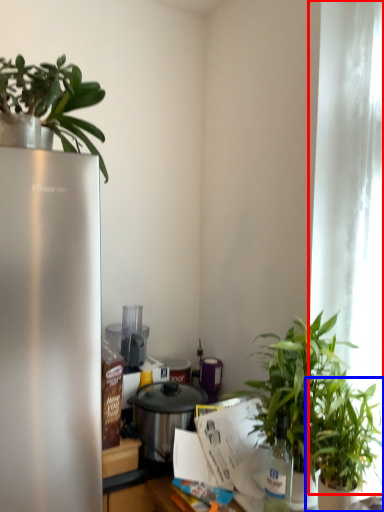
Question: Which point is closer to the camera, window screen (highlighted by a red box) or houseplant (highlighted by a blue box)?

Choices:
 (A) window screen
 (B) houseplant

Answer: (B)